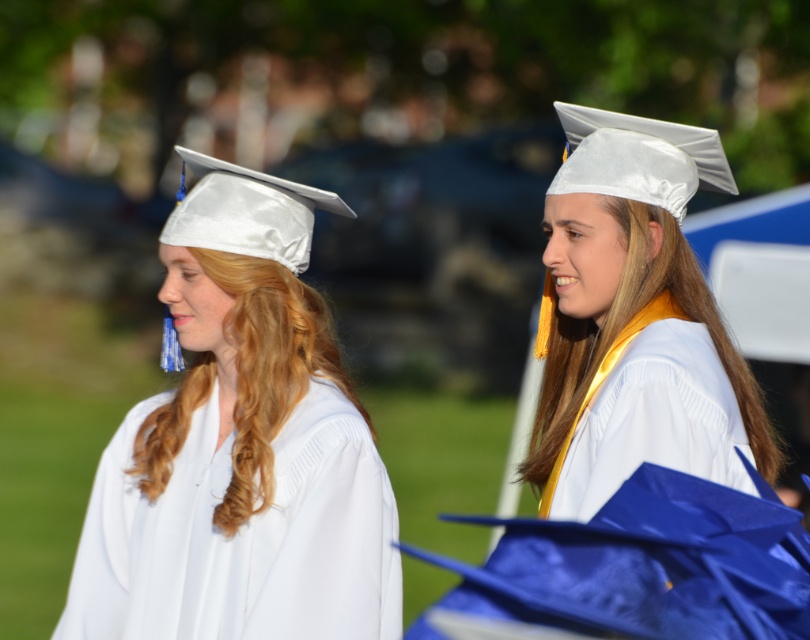
Question: In this image, where is white satin graduation cap at left located relative to white satin graduation gown at center?

Choices:
 (A) left
 (B) right

Answer: (A)

Question: Which object is the farthest from the white satin graduation cap at center?

Choices:
 (A) white satin graduation gown at center
 (B) white satin graduation cap at left

Answer: (B)

Question: Estimate the real-world distances between objects in this image. Which object is farther from the white satin graduation cap at left?

Choices:
 (A) white satin graduation gown at center
 (B) white satin graduation cap at center

Answer: (A)

Question: Does white satin graduation cap at left appear under white satin graduation gown at center?

Choices:
 (A) no
 (B) yes

Answer: (A)

Question: Which object is the farthest from the white satin graduation cap at center?

Choices:
 (A) white satin graduation cap at left
 (B) white satin graduation gown at center

Answer: (A)

Question: Does white satin graduation cap at center appear over white satin graduation gown at center?

Choices:
 (A) no
 (B) yes

Answer: (B)